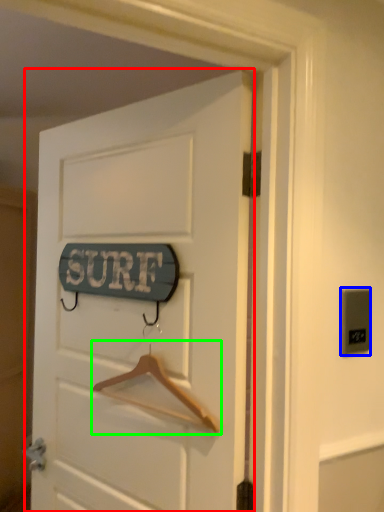
Question: Which object is the farthest from door (highlighted by a red box)? Choose among these: electric outlet (highlighted by a blue box) or hanger (highlighted by a green box).

Choices:
 (A) electric outlet
 (B) hanger

Answer: (A)